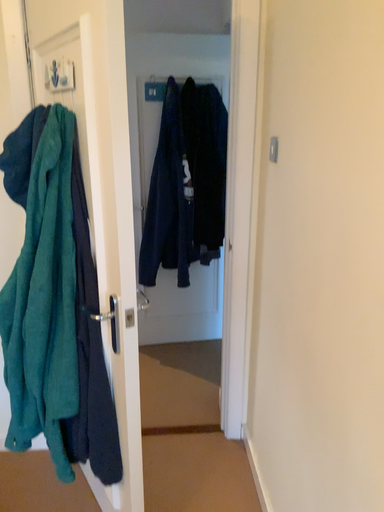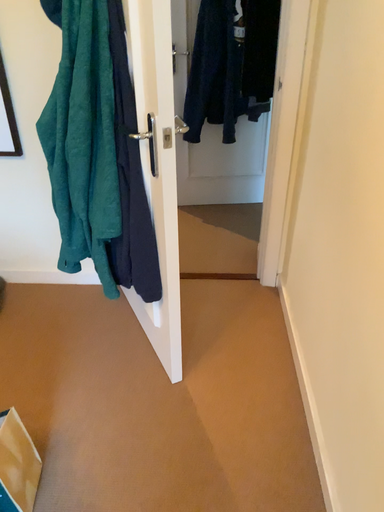
Question: How did the camera likely rotate when shooting the video?

Choices:
 (A) rotated right
 (B) rotated left

Answer: (B)